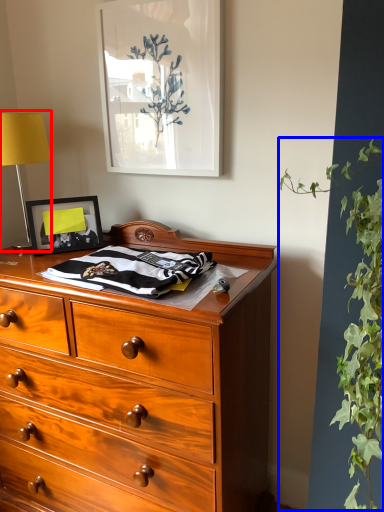
Question: Which point is closer to the camera, table lamp (highlighted by a red box) or vegetation (highlighted by a blue box)?

Choices:
 (A) table lamp
 (B) vegetation

Answer: (B)